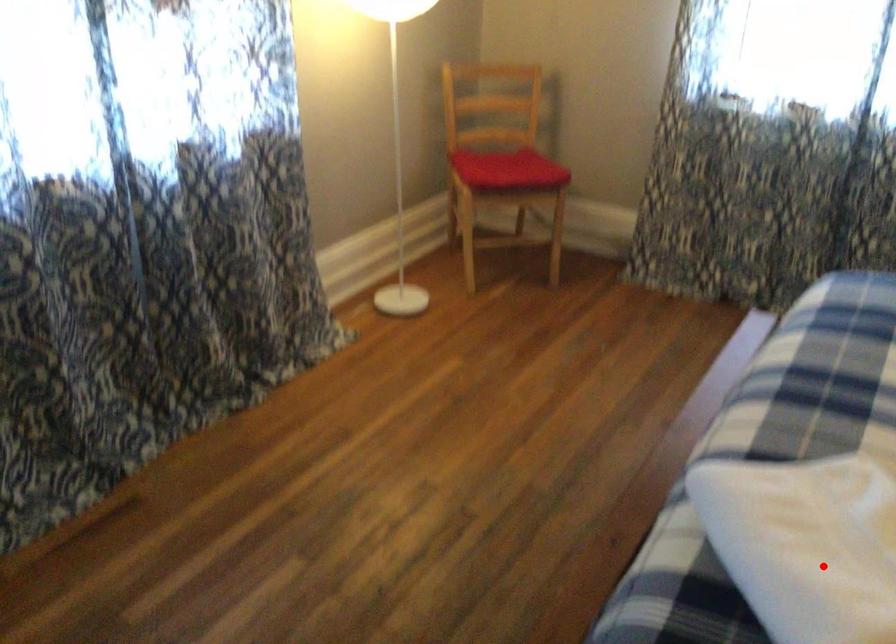
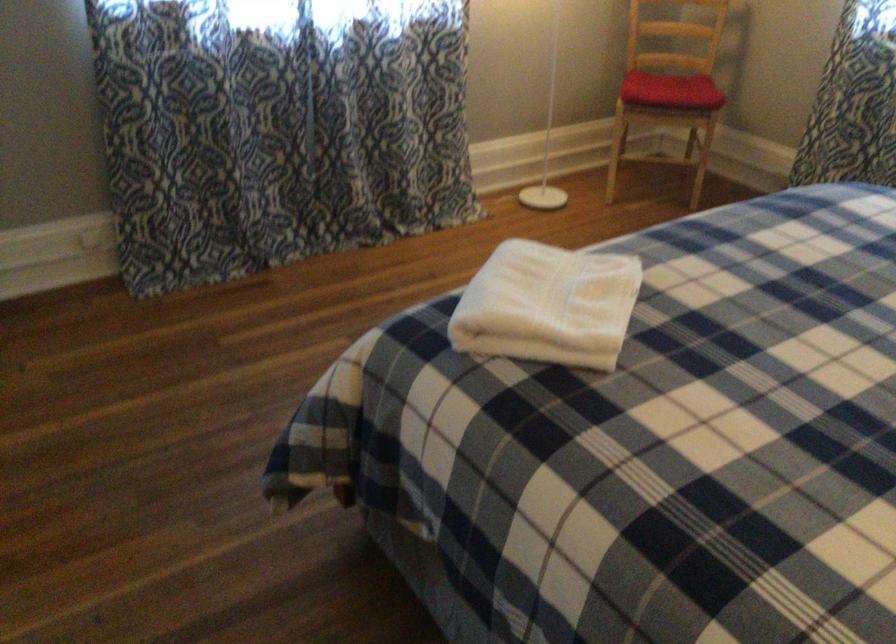
Question: I am providing you with two images of the same scene from different viewpoints. In image1, a red point is highlighted. Considering the same 3D point in image2, which of the following is correct?

Choices:
 (A) It is closer
 (B) It is farther

Answer: (B)